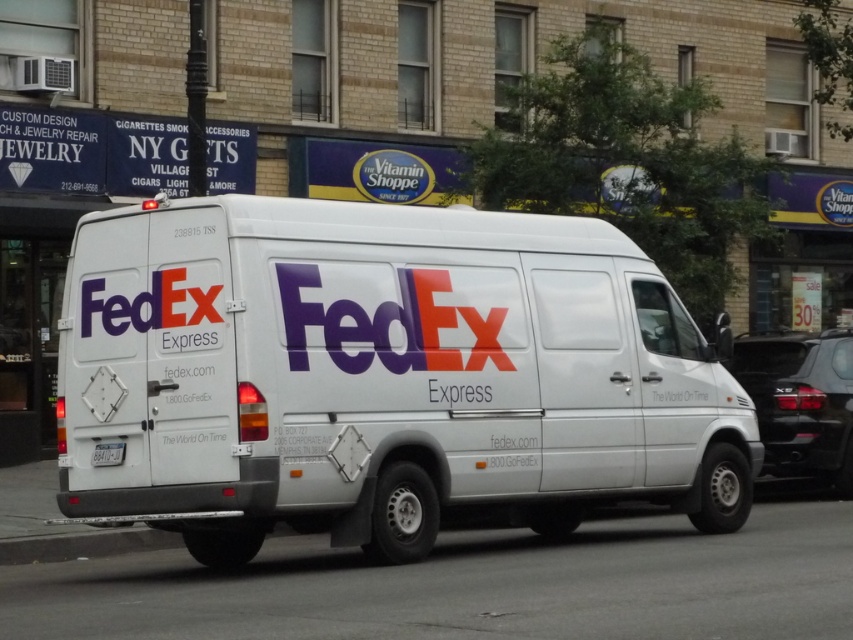
Question: Among these objects, which one is farthest from the camera?

Choices:
 (A) white plastic license plate at rear
 (B) black glossy suv at right

Answer: (B)

Question: Considering the relative positions of white matte fedex van at center and white plastic license plate at rear in the image provided, where is white matte fedex van at center located with respect to white plastic license plate at rear?

Choices:
 (A) left
 (B) right

Answer: (B)

Question: Can you confirm if black glossy suv at right is positioned below white plastic license plate at rear?

Choices:
 (A) no
 (B) yes

Answer: (A)

Question: Which of the following is the closest to the observer?

Choices:
 (A) (775, 419)
 (B) (99, 442)
 (C) (196, 376)

Answer: (C)

Question: Does white matte fedex van at center appear over white plastic license plate at rear?

Choices:
 (A) yes
 (B) no

Answer: (B)

Question: Which point is closer to the camera taking this photo?

Choices:
 (A) (817, 406)
 (B) (96, 448)
 (C) (643, 348)

Answer: (B)